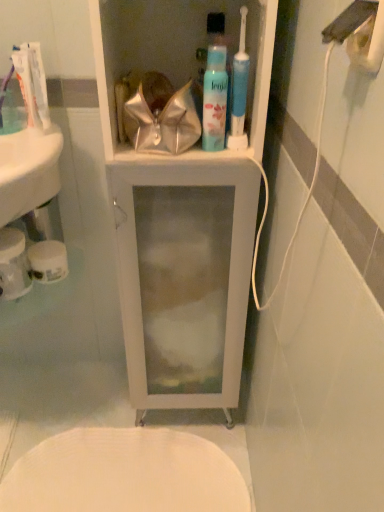
What do you see at coordinates (13, 264) in the screenshot? The image size is (384, 512). I see `white matte toilet paper at lower left, placed as the 1th toilet paper when sorted from left to right` at bounding box center [13, 264].

Describe the element at coordinates (124, 474) in the screenshot. I see `white textured toilet at lower center` at that location.

Describe the element at coordinates (215, 99) in the screenshot. The height and width of the screenshot is (512, 384). I see `translucent plastic mouthwash at upper center` at that location.

Locate an element on the screen. The image size is (384, 512). white matte toilet paper at lower left, which appears as the second toilet paper when viewed from the right is located at coordinates (13, 264).

Do you think white matte toilet paper at lower left, placed as the 1th toilet paper when sorted from left to right, is within white matte toilet paper at lower left, which is the first toilet paper in right-to-left order, or outside of it?

white matte toilet paper at lower left, placed as the 1th toilet paper when sorted from left to right, is located beyond the bounds of white matte toilet paper at lower left, which is the first toilet paper in right-to-left order.

Measure the distance between white matte toilet paper at lower left, which appears as the second toilet paper when viewed from the right, and white matte toilet paper at lower left, which appears as the 2th toilet paper when viewed from the left.

white matte toilet paper at lower left, which appears as the second toilet paper when viewed from the right, is 5.85 centimeters away from white matte toilet paper at lower left, which appears as the 2th toilet paper when viewed from the left.

From a real-world perspective, is white matte toilet paper at lower left, placed as the 1th toilet paper when sorted from left to right, above or below white matte toilet paper at lower left, which is the first toilet paper in right-to-left order?

In terms of real-world spatial position, white matte toilet paper at lower left, placed as the 1th toilet paper when sorted from left to right, is above white matte toilet paper at lower left, which is the first toilet paper in right-to-left order.

Is white matte toilet paper at lower left, which appears as the second toilet paper when viewed from the right, facing towards white matte toilet paper at lower left, which is the first toilet paper in right-to-left order?

No, white matte toilet paper at lower left, which appears as the second toilet paper when viewed from the right, does not turn towards white matte toilet paper at lower left, which is the first toilet paper in right-to-left order.

From the picture: From a real-world perspective, which object stands above the other?

From a 3D spatial view, translucent plastic toothpaste at upper left, which appears as the 2th toothpaste when viewed from the back, is above.

Considering the sizes of objects translucent plastic toothpaste at upper left, which appears as the 2th toothpaste when viewed from the back, and white matte toilet paper at lower left, which appears as the 2th toilet paper when viewed from the left, in the image provided, who is shorter, translucent plastic toothpaste at upper left, which appears as the 2th toothpaste when viewed from the back, or white matte toilet paper at lower left, which appears as the 2th toilet paper when viewed from the left,?

With less height is white matte toilet paper at lower left, which appears as the 2th toilet paper when viewed from the left.

Which object is positioned more to the right, translucent plastic toothpaste at upper left, marked as the first toothpaste in a front-to-back arrangement, or white matte toilet paper at lower left, which appears as the 2th toilet paper when viewed from the left?

translucent plastic toothpaste at upper left, marked as the first toothpaste in a front-to-back arrangement, is more to the right.

At what (x,y) coordinates should I click in order to perform the action: click on bathroom cabinet that appears above the white matte toilet paper at lower left, which is the first toilet paper in right-to-left order (from the image's perspective). Please return your answer as a coordinate pair (x, y). Looking at the image, I should click on (182, 209).

Does point (34, 257) lie behind point (229, 1)?

Yes, point (34, 257) is behind point (229, 1).

Considering the relative positions of white matte toilet paper at lower left, which appears as the 2th toilet paper when viewed from the left, and white glossy cabinet at center in the image provided, is white matte toilet paper at lower left, which appears as the 2th toilet paper when viewed from the left, to the left or to the right of white glossy cabinet at center?

Based on their positions, white matte toilet paper at lower left, which appears as the 2th toilet paper when viewed from the left, is located to the left of white glossy cabinet at center.

Is white matte toilet paper at lower left, which appears as the 2th toilet paper when viewed from the left, not near white glossy cabinet at center?

That's not correct — white matte toilet paper at lower left, which appears as the 2th toilet paper when viewed from the left, is a little close to white glossy cabinet at center.

Consider the image. Considering the relative sizes of white glossy toothpaste at upper left, which appears as the 1th toothpaste when viewed from the back, and white matte toilet paper at lower left, which is the first toilet paper in right-to-left order, in the image provided, is white glossy toothpaste at upper left, which appears as the 1th toothpaste when viewed from the back, wider than white matte toilet paper at lower left, which is the first toilet paper in right-to-left order,?

No.

From the image's perspective, is white glossy toothpaste at upper left, which appears as the 1th toothpaste when viewed from the back, above white matte toilet paper at lower left, which is the first toilet paper in right-to-left order?

Yes.

Is white glossy toothpaste at upper left, placed as the 2th toothpaste when sorted from front to back, shorter than white matte toilet paper at lower left, which appears as the 2th toilet paper when viewed from the left?

No, white glossy toothpaste at upper left, placed as the 2th toothpaste when sorted from front to back, is not shorter than white matte toilet paper at lower left, which appears as the 2th toilet paper when viewed from the left.

Could you tell me if white matte toilet paper at lower left, which appears as the second toilet paper when viewed from the right, is facing white glossy sink at left?

No, white matte toilet paper at lower left, which appears as the second toilet paper when viewed from the right, does not turn towards white glossy sink at left.

Is white matte toilet paper at lower left, placed as the 1th toilet paper when sorted from left to right, at the right side of white glossy sink at left?

In fact, white matte toilet paper at lower left, placed as the 1th toilet paper when sorted from left to right, is to the left of white glossy sink at left.

Measure the distance between white matte toilet paper at lower left, which appears as the second toilet paper when viewed from the right, and white glossy sink at left.

The distance of white matte toilet paper at lower left, which appears as the second toilet paper when viewed from the right, from white glossy sink at left is 5.17 inches.

Is point (21, 250) less distant than point (45, 210)?

Yes, it is.

From the image's perspective, is white matte toilet paper at lower left, placed as the 1th toilet paper when sorted from left to right, beneath translucent plastic mouthwash at upper center?

Correct, white matte toilet paper at lower left, placed as the 1th toilet paper when sorted from left to right, appears lower than translucent plastic mouthwash at upper center in the image.

Is white matte toilet paper at lower left, placed as the 1th toilet paper when sorted from left to right, closer to camera compared to translucent plastic mouthwash at upper center?

That is False.

From a real-world perspective, is white matte toilet paper at lower left, which appears as the second toilet paper when viewed from the right, physically below translucent plastic mouthwash at upper center?

Indeed, from a real-world perspective, white matte toilet paper at lower left, which appears as the second toilet paper when viewed from the right, is positioned beneath translucent plastic mouthwash at upper center.

Can you confirm if white matte toilet paper at lower left, placed as the 1th toilet paper when sorted from left to right, is wider than translucent plastic mouthwash at upper center?

Correct, the width of white matte toilet paper at lower left, placed as the 1th toilet paper when sorted from left to right, exceeds that of translucent plastic mouthwash at upper center.

Based on the photo, could you tell me if white textured toilet at lower center is turned towards white matte toilet paper at lower left, which is the first toilet paper in right-to-left order?

No, white textured toilet at lower center is not aimed at white matte toilet paper at lower left, which is the first toilet paper in right-to-left order.

In the scene shown: Considering the relative sizes of white textured toilet at lower center and white matte toilet paper at lower left, which appears as the 2th toilet paper when viewed from the left, in the image provided, is white textured toilet at lower center smaller than white matte toilet paper at lower left, which appears as the 2th toilet paper when viewed from the left,?

Incorrect, white textured toilet at lower center is not smaller in size than white matte toilet paper at lower left, which appears as the 2th toilet paper when viewed from the left.

In terms of height, does white textured toilet at lower center look taller or shorter compared to white matte toilet paper at lower left, which is the first toilet paper in right-to-left order?

Considering their sizes, white textured toilet at lower center has less height than white matte toilet paper at lower left, which is the first toilet paper in right-to-left order.

Where is `toilet paper above the white matte toilet paper at lower left, which appears as the 2th toilet paper when viewed from the left (from a real-world perspective)`? This screenshot has height=512, width=384. toilet paper above the white matte toilet paper at lower left, which appears as the 2th toilet paper when viewed from the left (from a real-world perspective) is located at coordinates (13, 264).

From the image's perspective, which toilet paper is the 2nd one below the translucent plastic toothpaste at upper left, marked as the first toothpaste in a front-to-back arrangement? Please provide its 2D coordinates.

[(48, 261)]

From the image, which object appears to be farther from translucent plastic toothpaste at upper left, marked as the first toothpaste in a front-to-back arrangement, translucent plastic mouthwash at upper center or white matte toilet paper at lower left, which is the first toilet paper in right-to-left order?

Among the two, translucent plastic mouthwash at upper center is located further to translucent plastic toothpaste at upper left, marked as the first toothpaste in a front-to-back arrangement.

Based on their spatial positions, is white glossy cabinet at center or white glossy toothpaste at upper left, which appears as the 1th toothpaste when viewed from the back, further from white matte toilet paper at lower left, which appears as the second toilet paper when viewed from the right?

white glossy cabinet at center is positioned further to the anchor white matte toilet paper at lower left, which appears as the second toilet paper when viewed from the right.

Estimate the real-world distances between objects in this image. Which object is closer to white glossy cabinet at center, white matte toilet paper at lower left, which appears as the 2th toilet paper when viewed from the left, or white textured toilet at lower center?

The object closer to white glossy cabinet at center is white matte toilet paper at lower left, which appears as the 2th toilet paper when viewed from the left.

When comparing their distances from translucent plastic toothpaste at upper left, marked as the first toothpaste in a front-to-back arrangement, does white glossy toothpaste at upper left, which appears as the 1th toothpaste when viewed from the back, or white glossy sink at left seem closer?

white glossy toothpaste at upper left, which appears as the 1th toothpaste when viewed from the back, is closer to translucent plastic toothpaste at upper left, marked as the first toothpaste in a front-to-back arrangement.

When comparing their distances from white glossy toothpaste at upper left, placed as the 2th toothpaste when sorted from front to back, does white matte toilet paper at lower left, placed as the 1th toilet paper when sorted from left to right, or white textured toilet at lower center seem further?

The object further to white glossy toothpaste at upper left, placed as the 2th toothpaste when sorted from front to back, is white textured toilet at lower center.

Looking at the image, which one is located further to white glossy cabinet at center, white textured toilet at lower center or white glossy sink at left?

The object further to white glossy cabinet at center is white textured toilet at lower center.

When comparing their distances from white glossy sink at left, does translucent plastic toothpaste at upper left, marked as the first toothpaste in a front-to-back arrangement, or translucent plastic mouthwash at upper center seem closer?

The object closer to white glossy sink at left is translucent plastic toothpaste at upper left, marked as the first toothpaste in a front-to-back arrangement.

Estimate the real-world distances between objects in this image. Which object is further from white textured toilet at lower center, translucent plastic toothpaste at upper left, which appears as the 2th toothpaste when viewed from the back, or white matte toilet paper at lower left, which appears as the second toilet paper when viewed from the right?

translucent plastic toothpaste at upper left, which appears as the 2th toothpaste when viewed from the back, is further to white textured toilet at lower center.

Identify the location of toilet paper between translucent plastic toothpaste at upper left, which appears as the 2th toothpaste when viewed from the back, and white matte toilet paper at lower left, which appears as the 2th toilet paper when viewed from the left, in the up-down direction. This screenshot has width=384, height=512. (13, 264).

Find the location of a particular element. toilet paper between white glossy sink at left and translucent plastic mouthwash at upper center is located at coordinates (48, 261).

You are a GUI agent. You are given a task and a screenshot of the screen. Output one action in this format:
    pyautogui.click(x=<x>, y=<y>)
    Task: Click on the mouthwash that lies between white glossy toothpaste at upper left, which appears as the 1th toothpaste when viewed from the back, and white textured toilet at lower center from top to bottom
    
    Given the screenshot: What is the action you would take?
    pyautogui.click(x=215, y=99)

Identify the location of bathroom cabinet between white glossy toothpaste at upper left, which appears as the 1th toothpaste when viewed from the back, and white textured toilet at lower center vertically. (182, 209).